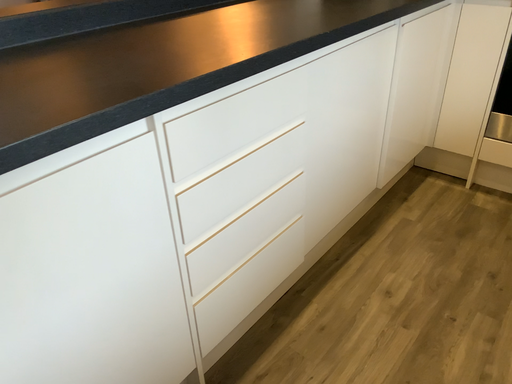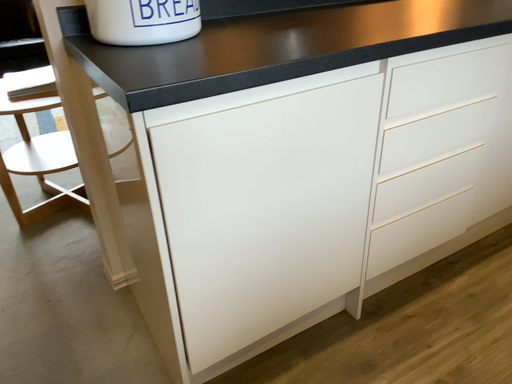
Question: How did the camera likely rotate when shooting the video?

Choices:
 (A) rotated right
 (B) rotated left

Answer: (B)